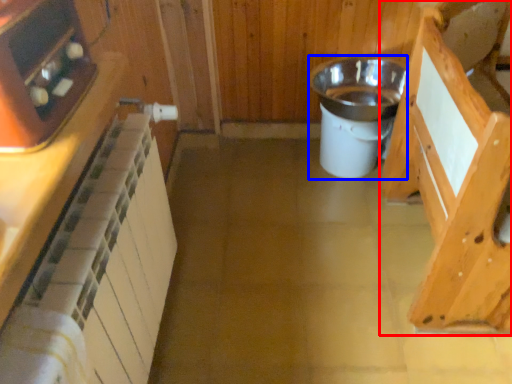
Question: Which point is closer to the camera, cabinetry (highlighted by a red box) or appliance (highlighted by a blue box)?

Choices:
 (A) cabinetry
 (B) appliance

Answer: (A)